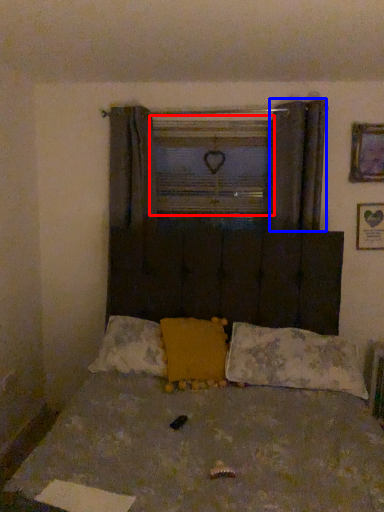
Question: Which object appears farthest to the camera in this image, window frame (highlighted by a red box) or curtain (highlighted by a blue box)?

Choices:
 (A) window frame
 (B) curtain

Answer: (A)